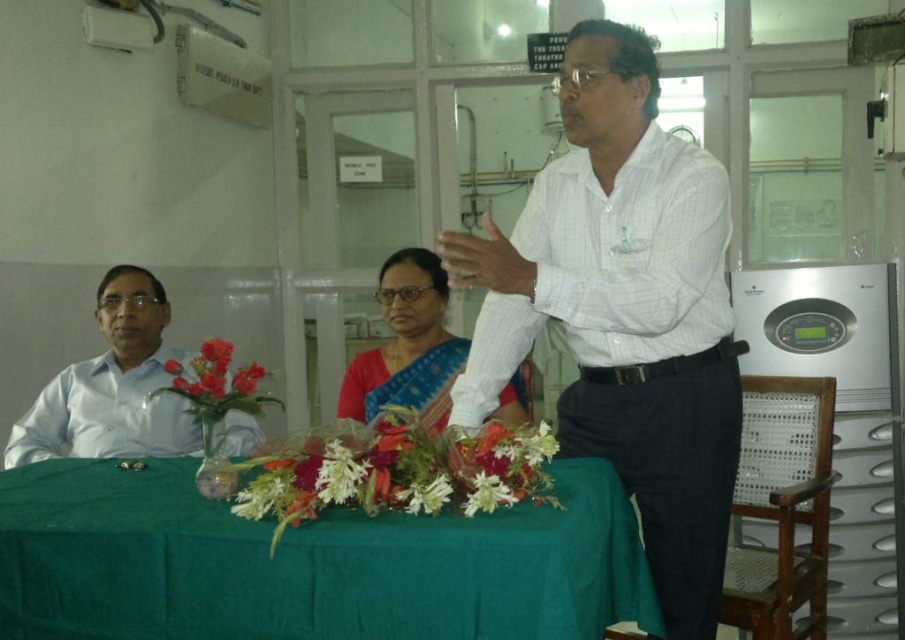
You are organizing a photo shoot and need to arrange the white shirt at left and the satin sari at center based on their sizes. Which one should you place first if you want to arrange them from largest to smallest?

The white shirt at left should be placed first since it has a larger size compared to the satin sari at center.